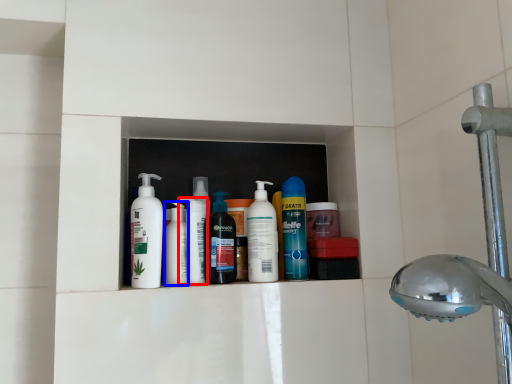
Question: Which object appears farthest to the camera in this image, cleaning product (highlighted by a red box) or toiletry (highlighted by a blue box)?

Choices:
 (A) cleaning product
 (B) toiletry

Answer: (B)